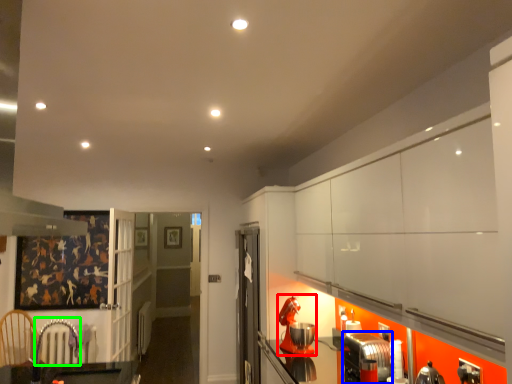
Question: Considering the real-world distances, which object is farthest from appliance (highlighted by a red box)? appliance (highlighted by a blue box) or armchair (highlighted by a green box)?

Choices:
 (A) appliance
 (B) armchair

Answer: (B)